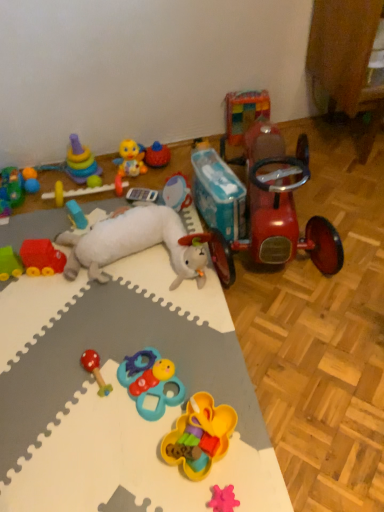
Locate an element on the screen. vacant space in between blue rubber rattle at center, the sixth toy positioned from the right, and matte blue car at center-left, arranged as the 3th toy when viewed from the left is located at coordinates (124, 317).